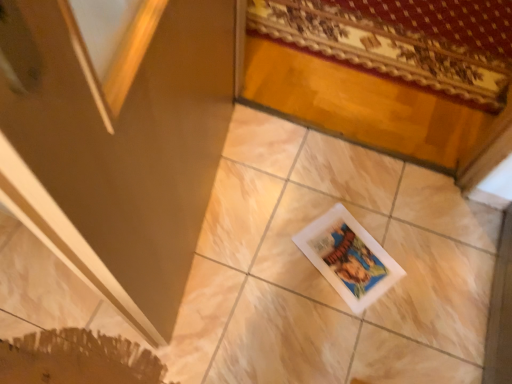
Locate an element on the screen. The height and width of the screenshot is (384, 512). unoccupied space behind white matte picture frame at center is located at coordinates (348, 194).